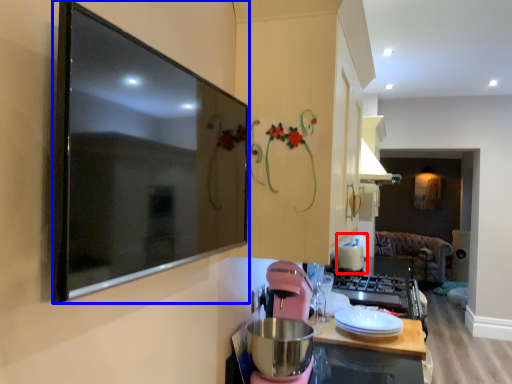
Question: Which point is closer to the camera, appliance (highlighted by a red box) or picture frame (highlighted by a blue box)?

Choices:
 (A) appliance
 (B) picture frame

Answer: (B)